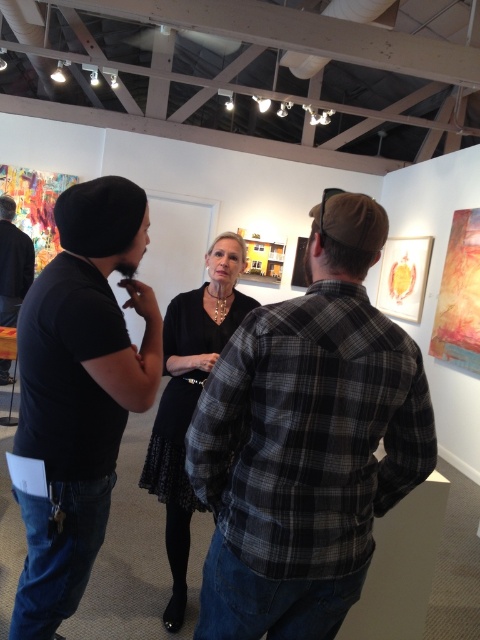
Question: Considering the real-world distances, which object is farthest from the plaid flannel shirt at center?

Choices:
 (A) black dress at center
 (B) matte black shirt at left
 (C) black matte t-shirt at left

Answer: (B)

Question: Can you confirm if black matte t-shirt at left is wider than matte black shirt at left?

Choices:
 (A) yes
 (B) no

Answer: (A)

Question: Which object is the closest to the black dress at center?

Choices:
 (A) black matte t-shirt at left
 (B) matte black shirt at left

Answer: (A)

Question: Does plaid flannel shirt at center have a smaller size compared to black dress at center?

Choices:
 (A) yes
 (B) no

Answer: (A)

Question: Which of these objects is positioned closest to the black matte t-shirt at left?

Choices:
 (A) black dress at center
 (B) plaid flannel shirt at center
 (C) matte black shirt at left

Answer: (B)

Question: Does plaid flannel shirt at center come in front of black dress at center?

Choices:
 (A) yes
 (B) no

Answer: (A)